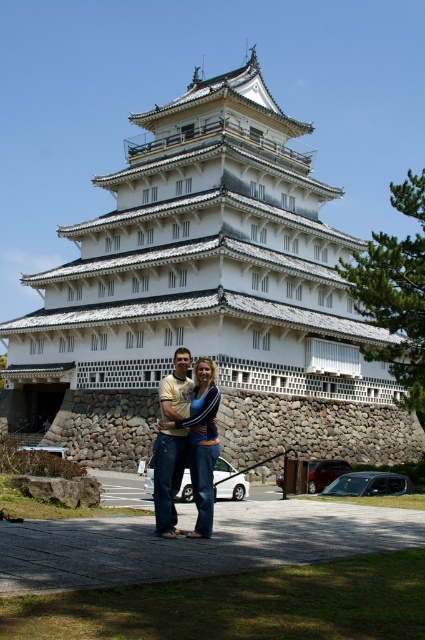
You are a photographer taking a picture of the white wooden palace at center and the denim jeans at center. Which object should you focus on first if you want to capture both in a single frame without zooming in or out?

The white wooden palace at center is bigger than denim jeans at center, so you should focus on the white wooden palace at center first to ensure it is properly framed before adjusting for the smaller denim jeans at center.

You are a photographer planning to capture the white wooden palace at center and the denim jeans at center in a single frame. Based on their sizes, which object should you prioritize positioning closer to the camera to ensure it appears larger in the photo?

The white wooden palace at center might be wider than denim jeans at center, so to ensure it appears larger in the photo, prioritize positioning the white wooden palace at center closer to the camera.

Looking at this image, you are standing in front of the Japanese castle and want to take a photo of the point at coordinates point [159,220]. If your camera has a maximum focus range of 60 meters, will it be able to focus on that point?

The distance of point [159,220] from viewer is 64.40 meters, which exceeds the camera maximum focus range of 60 meters. So the camera cannot focus on that point.